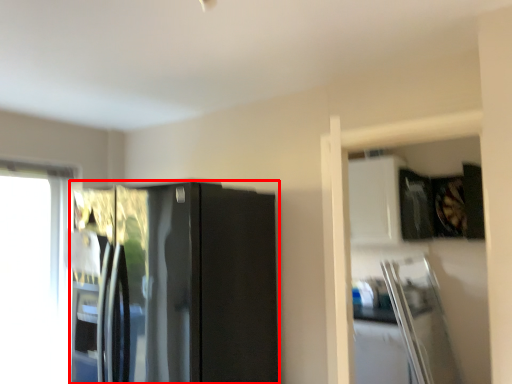
Question: From the image, what is the correct spatial relationship of refrigerator (annotated by the red box) in relation to window?

Choices:
 (A) right
 (B) left

Answer: (A)